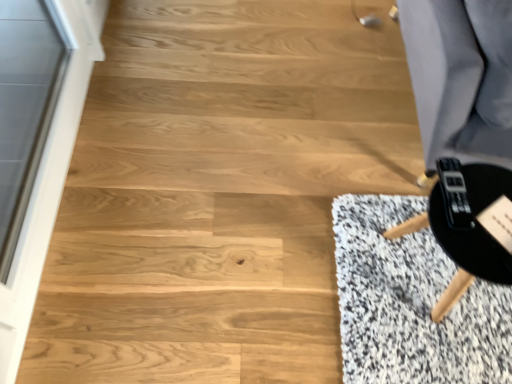
This screenshot has height=384, width=512. Find the location of `vacant space in between black matte round table at lower right and transparent glass screen door at left`. vacant space in between black matte round table at lower right and transparent glass screen door at left is located at coordinates (207, 223).